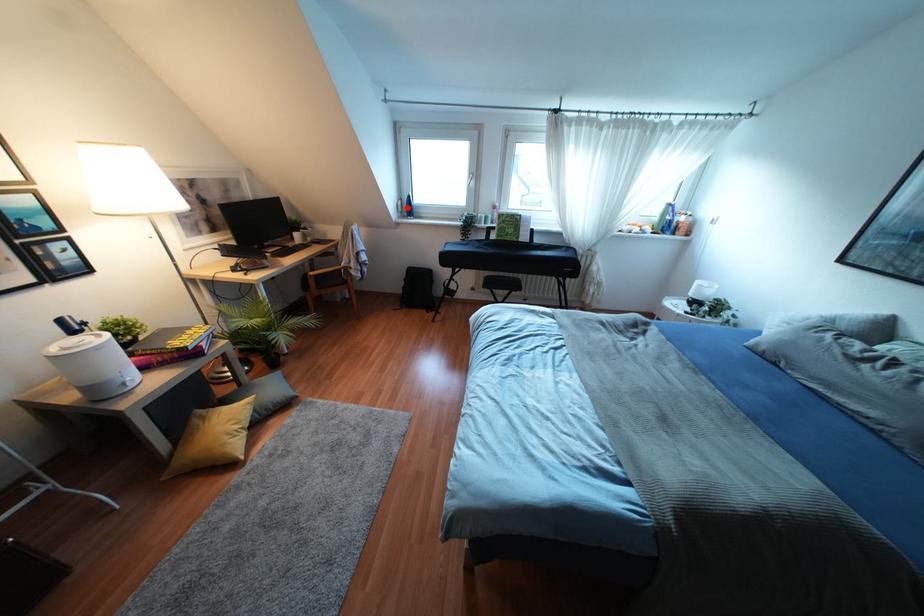
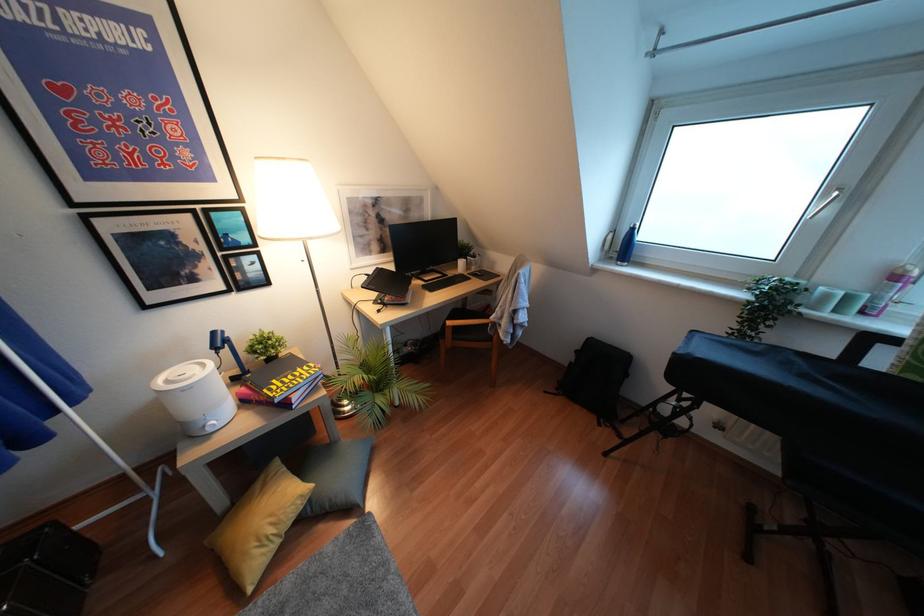
Where in the second image is the point corresponding to the highlighted location from the first image?

(623, 246)